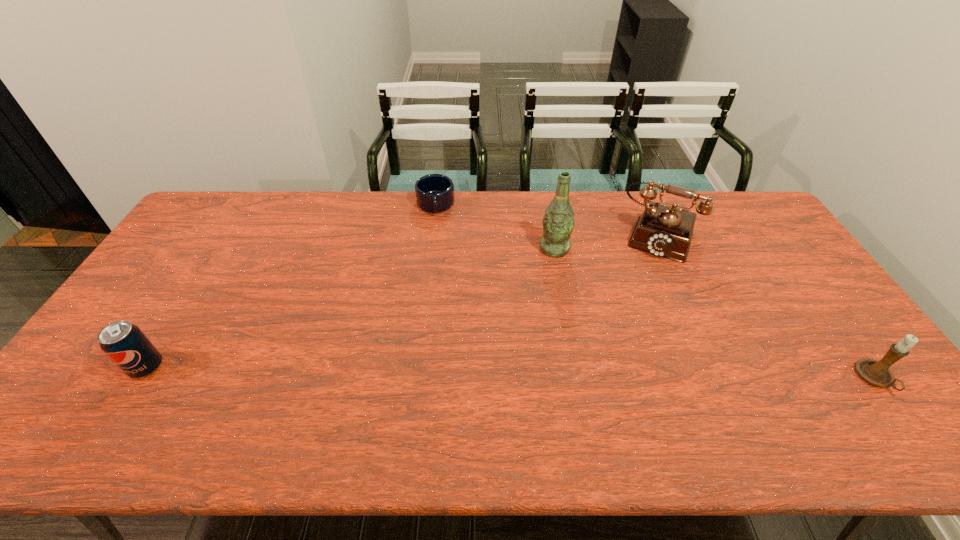
I want to click on empty location between the leftmost object and the rightmost object, so click(512, 373).

This screenshot has height=540, width=960. Identify the location of vacant area between the beer bottle and the second tallest object. (607, 242).

You are a GUI agent. You are given a task and a screenshot of the screen. Output one action in this format:
    pyautogui.click(x=<x>, y=<y>)
    Task: Click on the empty location between the candle holder and the mug
    This screenshot has width=960, height=540.
    Given the screenshot: What is the action you would take?
    pos(656,292)

This screenshot has height=540, width=960. Find the location of `free point between the candle holder and the shortest object`. free point between the candle holder and the shortest object is located at coordinates (656, 292).

Identify the location of free spot between the leftmost object and the shortest object. This screenshot has width=960, height=540. (291, 286).

Locate an element on the screen. This screenshot has height=540, width=960. free space that is in between the candle holder and the tallest object is located at coordinates (715, 314).

The width and height of the screenshot is (960, 540). I want to click on free space between the tallest object and the leftmost object, so click(350, 308).

At what (x,y) coordinates should I click in order to perform the action: click on free space between the candle holder and the second object from right to left. Please return your answer as a coordinate pair (x, y). Looking at the image, I should click on (767, 307).

This screenshot has width=960, height=540. Find the location of `free space between the soda can and the fourth shortest object`. free space between the soda can and the fourth shortest object is located at coordinates (403, 302).

In order to click on free space between the candle holder and the fourth object from left to right in this screenshot , I will do `click(767, 307)`.